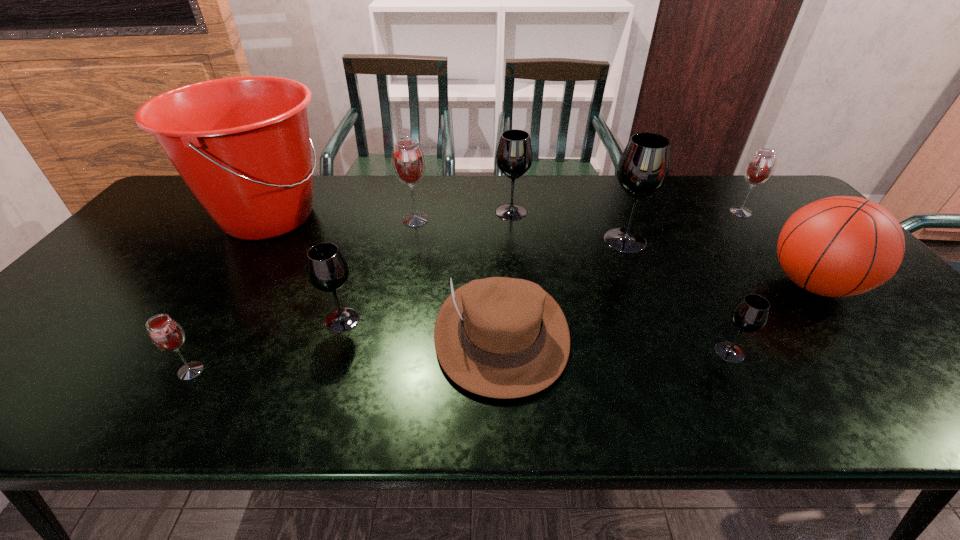
This screenshot has width=960, height=540. In order to click on the rightmost wineglass in this screenshot , I will do `click(760, 167)`.

Find the location of a particular element. This screenshot has width=960, height=540. the second wineglass from left to right is located at coordinates pyautogui.click(x=327, y=269).

The image size is (960, 540). In order to click on the leftmost gray wineglass in this screenshot , I will do pyautogui.click(x=327, y=269).

Identify the location of fedora. (499, 337).

Find the location of a particular element. the smallest gray wineglass is located at coordinates (750, 314).

Find the location of a particular element. the third object from right to left is located at coordinates (750, 314).

Where is `the leftmost red wineglass`? the leftmost red wineglass is located at coordinates (166, 334).

I want to click on the nearest red wineglass, so click(166, 334).

The image size is (960, 540). Find the location of `blank space located with the handle attached to the rim of the red bucket`. blank space located with the handle attached to the rim of the red bucket is located at coordinates (372, 217).

Where is `free space located 0.130m on the back of the second tallest object`? free space located 0.130m on the back of the second tallest object is located at coordinates (611, 205).